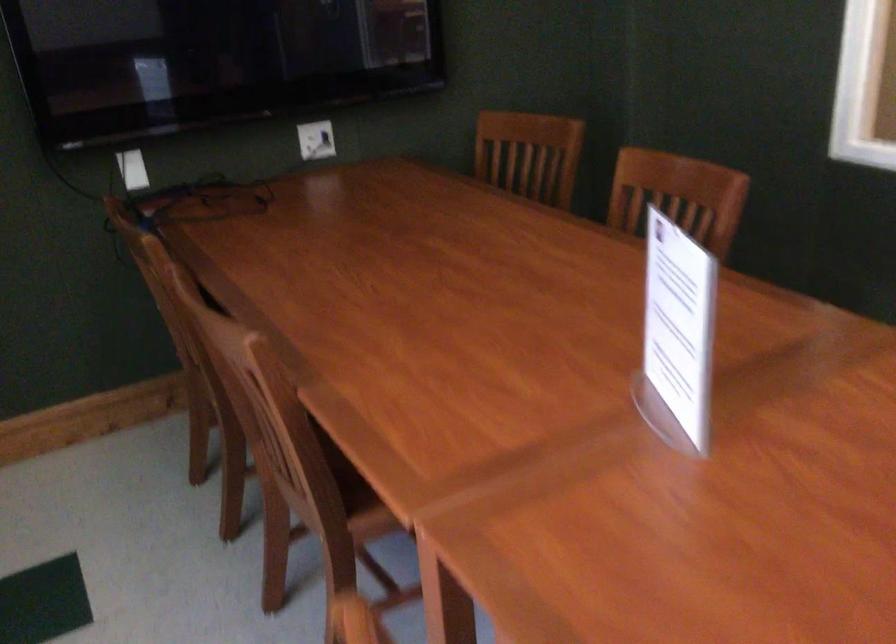
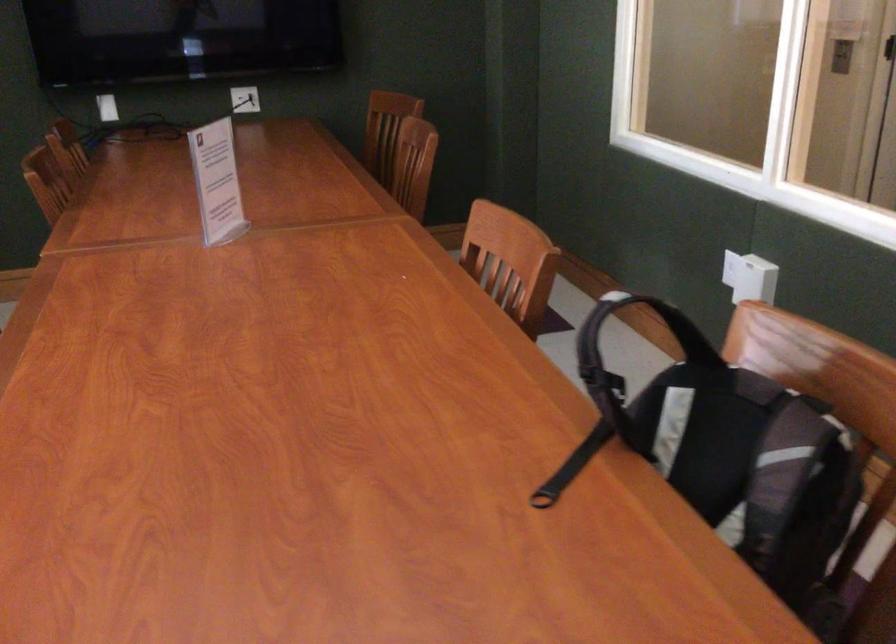
Where in the second image is the point corresponding to (657,328) from the first image?

(217, 182)